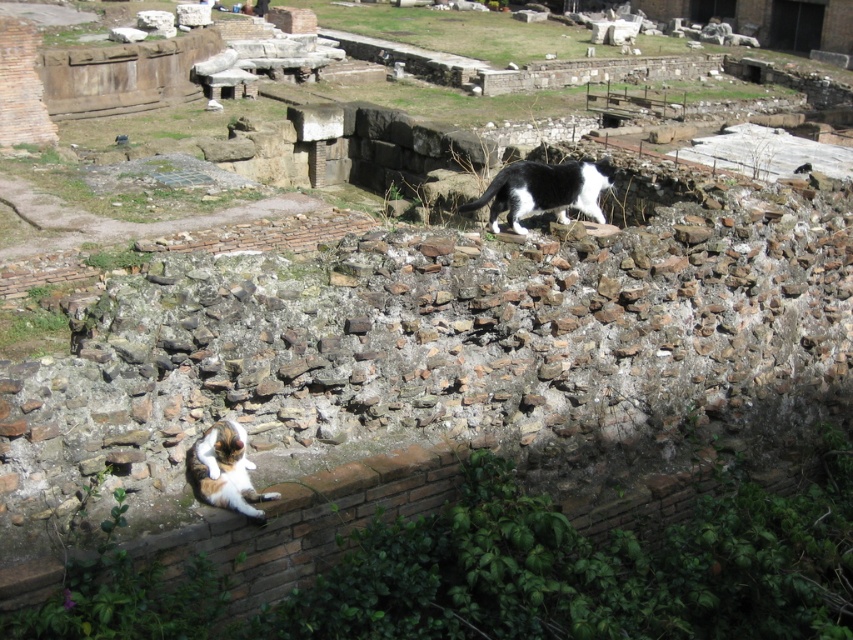
Is black and white fur cat at upper right smaller than calico fur cat at lower left?

Indeed, black and white fur cat at upper right has a smaller size compared to calico fur cat at lower left.

Which is below, black and white fur cat at upper right or calico fur cat at lower left?

calico fur cat at lower left

Identify the location of black and white fur cat at upper right. The width and height of the screenshot is (853, 640). (544, 192).